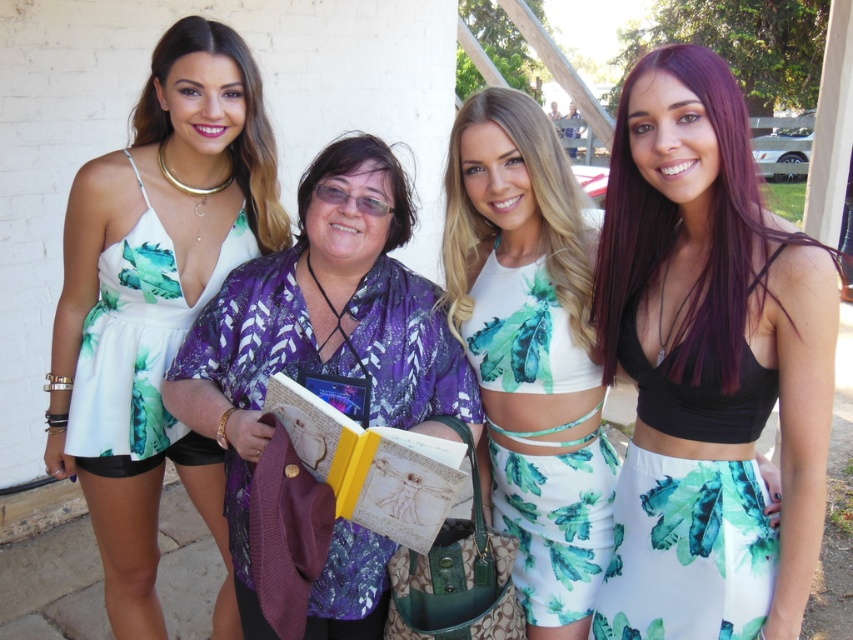
You are a photographer at the event and want to capture both the purple floral kimono at center and the white floral fabric dress at left in a single frame. Which of the two outfits should you focus on to ensure they both fit well in the photo?

The purple floral kimono at center is larger in size compared to the white floral fabric dress at left, so focusing on the purple floral kimono at center would ensure both outfits fit well in the photo.

You are standing at the position of point (643, 173) and want to walk towards point (268, 362). Will you be moving forward or backward relative to your current position?

Moving from point (643, 173) to point (268, 362) involves moving forward because the destination point is behind the starting point. Since point (643, 173) is in front of point (268, 362), you would need to move forward to reach it.